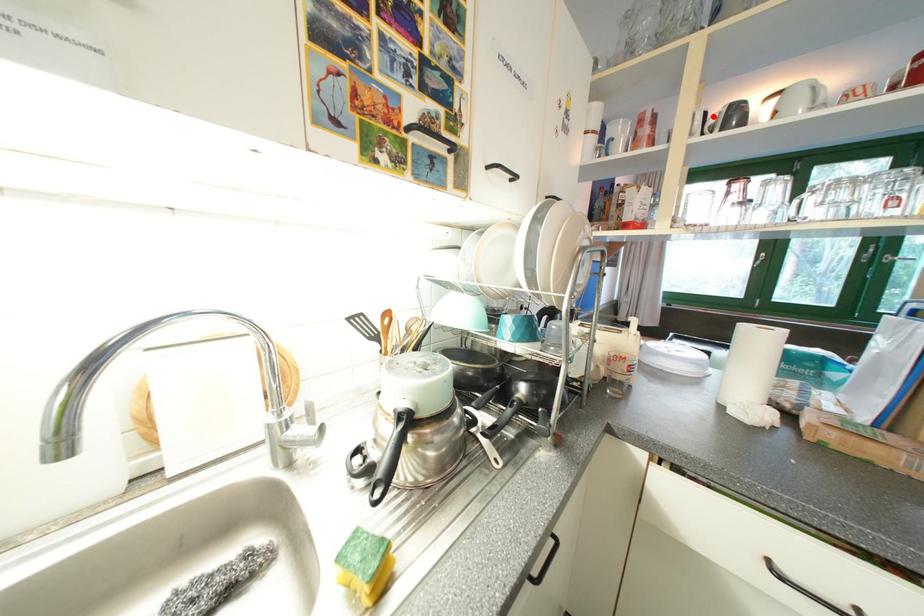
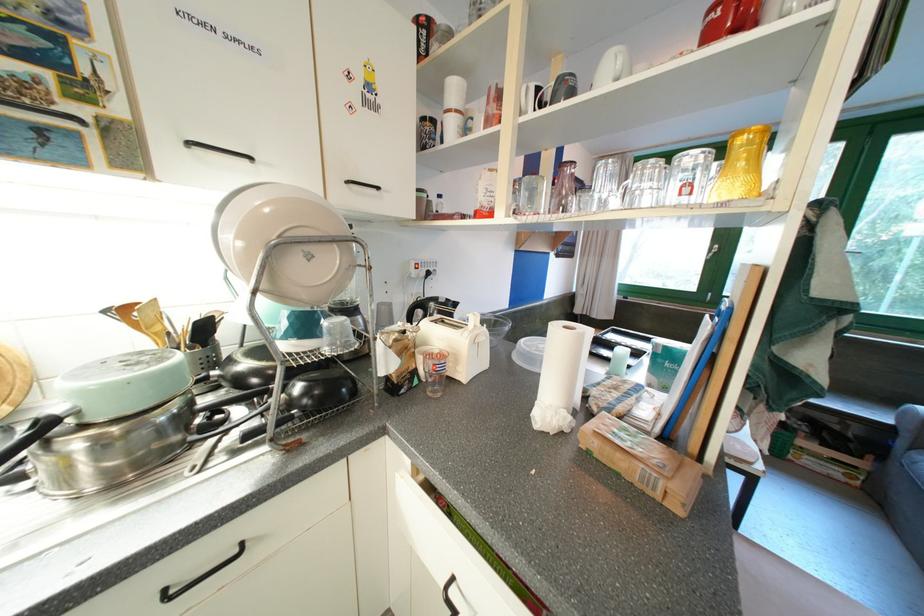
Where in the second image is the point corresponding to the highlighted location from the first image?

(545, 91)